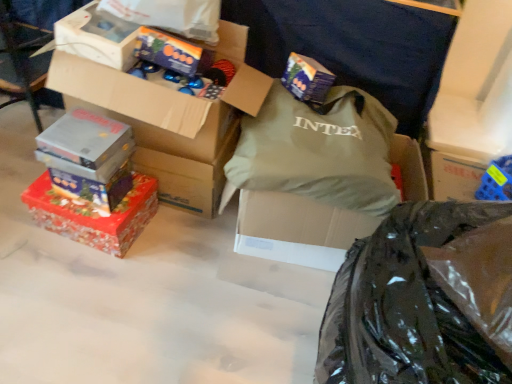
Question: Can you confirm if matte green pillow at center, which is the first box in right-to-left order, is smaller than black glossy plastic bag at lower right?

Choices:
 (A) no
 (B) yes

Answer: (B)

Question: From a real-world perspective, is matte green pillow at center, which is the first box in right-to-left order, located higher than black glossy plastic bag at lower right?

Choices:
 (A) yes
 (B) no

Answer: (B)

Question: Is matte green pillow at center, acting as the 7th box starting from the left, in contact with black glossy plastic bag at lower right?

Choices:
 (A) yes
 (B) no

Answer: (B)

Question: Is matte green pillow at center, which is the first box in right-to-left order, surrounding black glossy plastic bag at lower right?

Choices:
 (A) no
 (B) yes

Answer: (A)

Question: Does matte green pillow at center, which is the first box in right-to-left order, come in front of black glossy plastic bag at lower right?

Choices:
 (A) yes
 (B) no

Answer: (B)

Question: From a real-world perspective, is matte green pillow at center, acting as the 7th box starting from the left, under black glossy plastic bag at lower right?

Choices:
 (A) no
 (B) yes

Answer: (B)

Question: Considering the relative positions of shiny red wrapping paper at lower left, the 1th box when ordered from left to right, and metallic silver box at left, which appears as the 6th box when viewed from the right, in the image provided, is shiny red wrapping paper at lower left, the 1th box when ordered from left to right, behind metallic silver box at left, which appears as the 6th box when viewed from the right,?

Choices:
 (A) no
 (B) yes

Answer: (B)

Question: Is shiny red wrapping paper at lower left, placed as the seventh box when sorted from right to left, located outside metallic silver box at left, which appears as the 6th box when viewed from the right?

Choices:
 (A) no
 (B) yes

Answer: (B)

Question: From a real-world perspective, is shiny red wrapping paper at lower left, the 1th box when ordered from left to right, over metallic silver box at left, the second box positioned from the left?

Choices:
 (A) no
 (B) yes

Answer: (A)

Question: Considering the relative sizes of shiny red wrapping paper at lower left, placed as the seventh box when sorted from right to left, and metallic silver box at left, which appears as the 6th box when viewed from the right, in the image provided, is shiny red wrapping paper at lower left, placed as the seventh box when sorted from right to left, shorter than metallic silver box at left, which appears as the 6th box when viewed from the right,?

Choices:
 (A) no
 (B) yes

Answer: (A)

Question: Can you confirm if shiny red wrapping paper at lower left, placed as the seventh box when sorted from right to left, is taller than metallic silver box at left, the second box positioned from the left?

Choices:
 (A) yes
 (B) no

Answer: (A)

Question: Is shiny red wrapping paper at lower left, the 1th box when ordered from left to right, not close to metallic silver box at left, which appears as the 6th box when viewed from the right?

Choices:
 (A) no
 (B) yes

Answer: (A)

Question: Is shiny metallic box at upper center, positioned as the 2th box in right-to-left order, surrounded by green fabric bag at center?

Choices:
 (A) yes
 (B) no

Answer: (B)